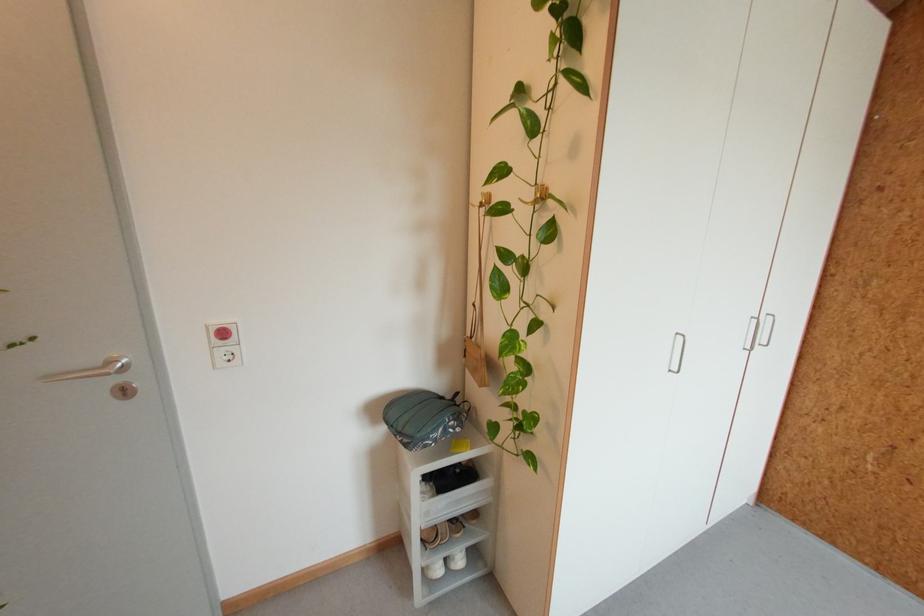
Image resolution: width=924 pixels, height=616 pixels. I want to click on silver door handle, so point(91,370).